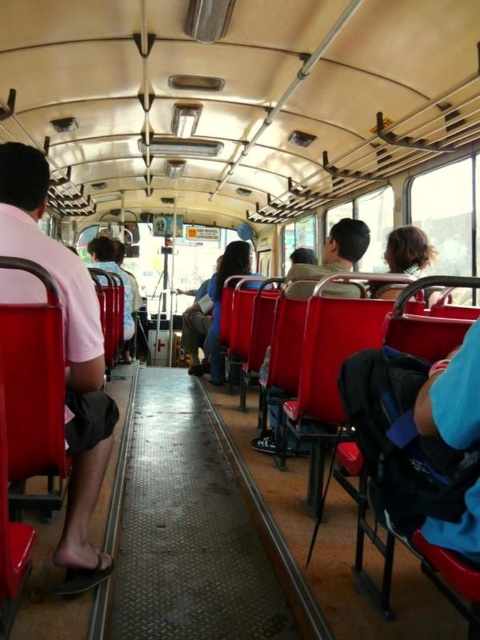
Question: Is pink cotton shirt at left positioned behind matte red seat at center?

Choices:
 (A) no
 (B) yes

Answer: (A)

Question: Does pink cotton shirt at left have a lesser width compared to matte red seat at center?

Choices:
 (A) yes
 (B) no

Answer: (A)

Question: Can you confirm if pink cotton shirt at left is positioned above matte red seat at center?

Choices:
 (A) no
 (B) yes

Answer: (A)

Question: Which object appears farthest from the camera in this image?

Choices:
 (A) matte red seat at center
 (B) pink cotton shirt at left

Answer: (A)

Question: Which object appears closest to the camera in this image?

Choices:
 (A) pink cotton shirt at left
 (B) matte red seat at center

Answer: (A)

Question: Which point appears farthest from the camera in this image?

Choices:
 (A) (108, 291)
 (B) (88, 346)

Answer: (A)